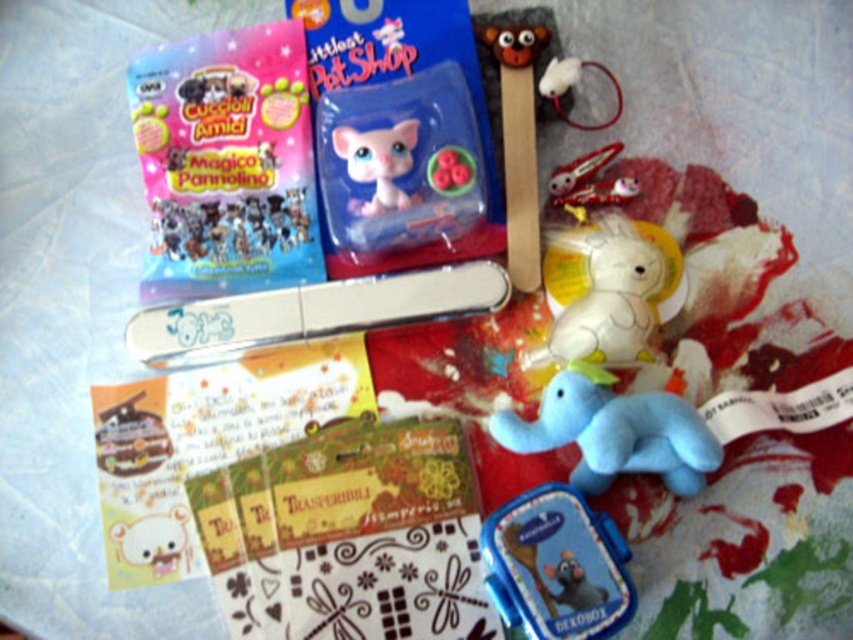
This screenshot has height=640, width=853. Find the location of `translucent plastic cat at center`. translucent plastic cat at center is located at coordinates (399, 163).

Can you confirm if translucent plastic cat at center is positioned above blue plush elephant at center?

Correct, translucent plastic cat at center is located above blue plush elephant at center.

Identify the location of translucent plastic cat at center. This screenshot has height=640, width=853. (399, 163).

Is pink glossy book at upper left bigger than white plush unicorn at upper center?

Indeed, pink glossy book at upper left has a larger size compared to white plush unicorn at upper center.

Between point (321, 259) and point (610, 262), which one is positioned in front?

Positioned in front is point (610, 262).

Identify the location of pink glossy book at upper left. This screenshot has width=853, height=640. (225, 163).

Does transperibile paper at center come in front of blue plush elephant at center?

No, it is behind blue plush elephant at center.

Looking at this image, who is more forward, (x=370, y=634) or (x=670, y=468)?

Point (x=370, y=634)

Who is more distant from viewer, (345, 432) or (648, 408)?

Positioned behind is point (345, 432).

Identify the location of transperibile paper at center. (349, 538).